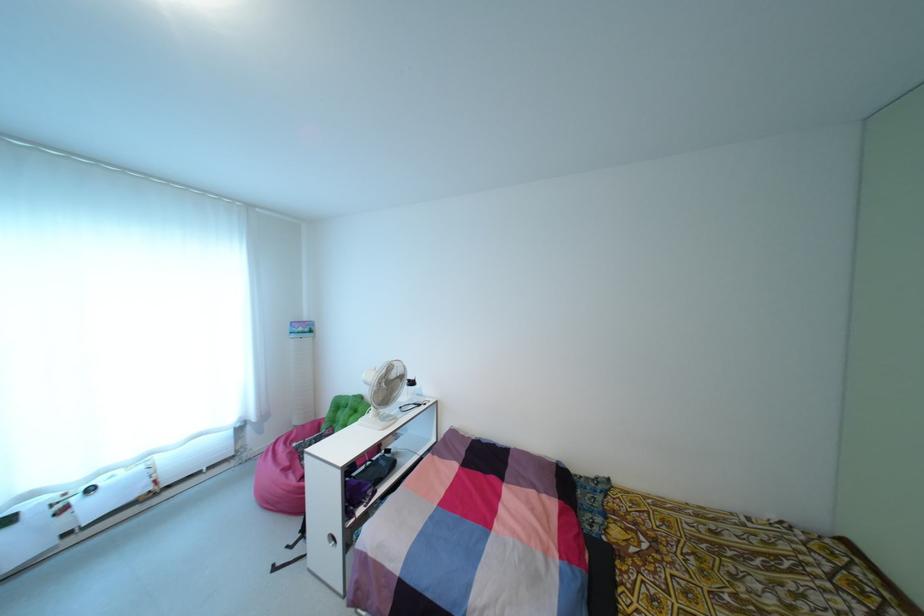
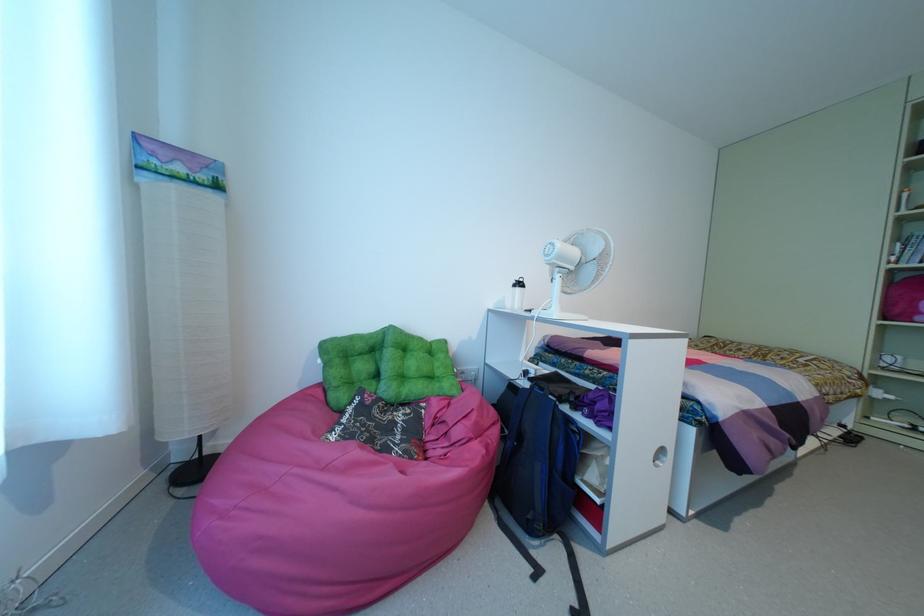
Find the pixel in the second image that matches pixel 342 402 in the first image.

(359, 345)